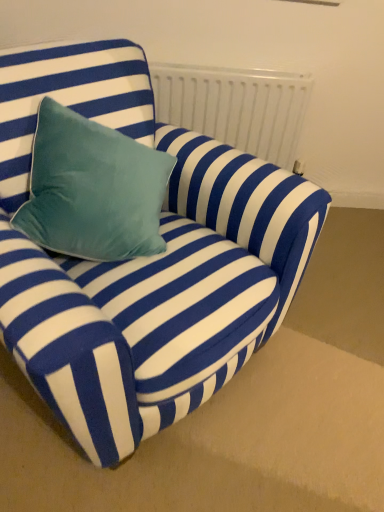
Describe the element at coordinates (144, 260) in the screenshot. I see `blue velvet couch at center` at that location.

Where is `blue velvet couch at center`? The image size is (384, 512). blue velvet couch at center is located at coordinates (144, 260).

Locate an element on the screen. Image resolution: width=384 pixels, height=512 pixels. white matte radiator at upper center is located at coordinates (235, 106).

Describe the element at coordinates (235, 106) in the screenshot. I see `white matte radiator at upper center` at that location.

You are a GUI agent. You are given a task and a screenshot of the screen. Output one action in this format:
    pyautogui.click(x=<x>, y=<y>)
    Task: Click on the blue velvet couch at center
    
    Given the screenshot: What is the action you would take?
    pyautogui.click(x=144, y=260)

Which is more to the left, blue velvet couch at center or white matte radiator at upper center?

blue velvet couch at center is more to the left.

Is blue velvet couch at center in front of white matte radiator at upper center?

Yes, blue velvet couch at center is closer to the viewer.

Which point is more forward, [80,265] or [247,92]?

The point [80,265] is closer.

From the image's perspective, does blue velvet couch at center appear higher than white matte radiator at upper center?

No, from the image's perspective, blue velvet couch at center is not over white matte radiator at upper center.

From a real-world perspective, between blue velvet couch at center and white matte radiator at upper center, who is vertically lower?

white matte radiator at upper center, from a real-world perspective.

In terms of width, does blue velvet couch at center look wider or thinner when compared to white matte radiator at upper center?

Considering their sizes, blue velvet couch at center looks broader than white matte radiator at upper center.

Does blue velvet couch at center have a greater height compared to white matte radiator at upper center?

Indeed, blue velvet couch at center has a greater height compared to white matte radiator at upper center.

In the scene shown: Considering the sizes of objects blue velvet couch at center and white matte radiator at upper center in the image provided, who is smaller, blue velvet couch at center or white matte radiator at upper center?

Smaller between the two is white matte radiator at upper center.

Choose the correct answer: Is blue velvet couch at center inside white matte radiator at upper center or outside it?

blue velvet couch at center is not enclosed by white matte radiator at upper center.

Consider the image. Is blue velvet couch at center with white matte radiator at upper center?

No, blue velvet couch at center is not beside white matte radiator at upper center.

Is blue velvet couch at center facing away from white matte radiator at upper center?

No, blue velvet couch at center is not facing away from white matte radiator at upper center.

Locate an element on the screen. This screenshot has width=384, height=512. studio couch in front of the white matte radiator at upper center is located at coordinates (144, 260).

In the scene shown: Considering the relative positions of white matte radiator at upper center and blue velvet couch at center in the image provided, is white matte radiator at upper center to the left or to the right of blue velvet couch at center?

From the image, it's evident that white matte radiator at upper center is to the right of blue velvet couch at center.

Considering the positions of objects white matte radiator at upper center and blue velvet couch at center in the image provided, who is in front, white matte radiator at upper center or blue velvet couch at center?

Positioned in front is blue velvet couch at center.

Which is in front, point (166, 74) or point (134, 445)?

The point (134, 445) is more forward.

From the image's perspective, which is below, white matte radiator at upper center or blue velvet couch at center?

blue velvet couch at center appears lower in the image.

Consider the image. From a real-world perspective, which object rests below the other?

white matte radiator at upper center is physically lower.

Can you confirm if white matte radiator at upper center is thinner than blue velvet couch at center?

Correct, the width of white matte radiator at upper center is less than that of blue velvet couch at center.

Who is shorter, white matte radiator at upper center or blue velvet couch at center?

Standing shorter between the two is white matte radiator at upper center.

Considering the sizes of objects white matte radiator at upper center and blue velvet couch at center in the image provided, who is smaller, white matte radiator at upper center or blue velvet couch at center?

white matte radiator at upper center is smaller.

Is white matte radiator at upper center located outside blue velvet couch at center?

Yes, white matte radiator at upper center is not within blue velvet couch at center.

Is white matte radiator at upper center touching blue velvet couch at center?

No, white matte radiator at upper center is not making contact with blue velvet couch at center.

Is white matte radiator at upper center turned away from blue velvet couch at center?

That's not correct — white matte radiator at upper center is not looking away from blue velvet couch at center.

What's the angular difference between white matte radiator at upper center and blue velvet couch at center's facing directions?

white matte radiator at upper center and blue velvet couch at center are facing 42.2 degrees away from each other.

Locate an element on the screen. The image size is (384, 512). radiator on the right of blue velvet couch at center is located at coordinates (235, 106).

The width and height of the screenshot is (384, 512). What are the coordinates of `radiator located underneath the blue velvet couch at center (from a real-world perspective)` in the screenshot? It's located at (235, 106).

Where is `studio couch lying in front of the white matte radiator at upper center`? The image size is (384, 512). studio couch lying in front of the white matte radiator at upper center is located at coordinates (144, 260).